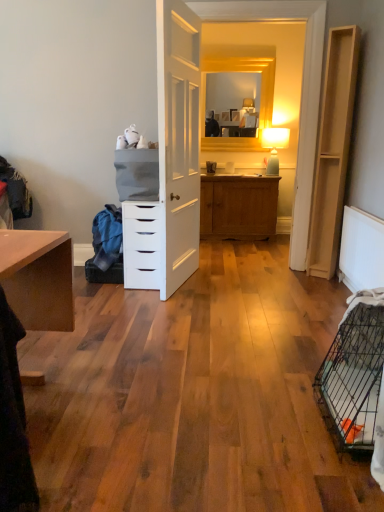
You are a GUI agent. You are given a task and a screenshot of the screen. Output one action in this format:
    pyautogui.click(x=<x>, y=<y>)
    Task: Click on the vacant space behind black wire birdcage at lower right
    The width and height of the screenshot is (384, 512).
    Given the screenshot: What is the action you would take?
    pyautogui.click(x=288, y=367)